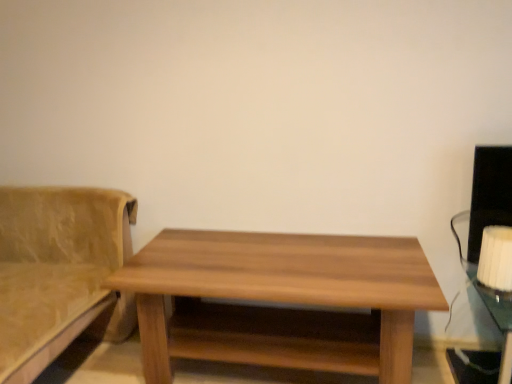
Locate an element on the screen. This screenshot has height=384, width=512. wooden table at center is located at coordinates (280, 300).

Describe the element at coordinates (496, 258) in the screenshot. This screenshot has width=512, height=384. I see `white fabric lampshade at right` at that location.

Describe the element at coordinates (59, 272) in the screenshot. I see `suede-like beige couch at left` at that location.

You are a GUI agent. You are given a task and a screenshot of the screen. Output one action in this format:
    pyautogui.click(x=<x>, y=<y>)
    Task: Click on the wooden table at center
    Image resolution: width=512 pixels, height=384 pixels.
    Given the screenshot: What is the action you would take?
    pyautogui.click(x=280, y=300)

Consider the image. Can we say suede-like beige couch at left lies outside white fabric lampshade at right?

That's correct, suede-like beige couch at left is outside of white fabric lampshade at right.

In the scene shown: Is suede-like beige couch at left in contact with white fabric lampshade at right?

suede-like beige couch at left and white fabric lampshade at right are not in contact.

From a real-world perspective, is suede-like beige couch at left positioned above or below white fabric lampshade at right?

Clearly, from a real-world perspective, suede-like beige couch at left is below white fabric lampshade at right.

Considering the positions of objects suede-like beige couch at left and white fabric lampshade at right in the image provided, who is more to the right, suede-like beige couch at left or white fabric lampshade at right?

Positioned to the right is white fabric lampshade at right.

From a real-world perspective, is white fabric lampshade at right over wooden table at center?

Yes, from a real-world perspective, white fabric lampshade at right is above wooden table at center.

In the image, is white fabric lampshade at right positioned in front of or behind wooden table at center?

white fabric lampshade at right is behind wooden table at center.

This screenshot has width=512, height=384. Identify the location of table lamp positioned vertically above the wooden table at center (from a real-world perspective). (496, 258).

Considering the positions of objects wooden table at center and suede-like beige couch at left in the image provided, who is more to the left, wooden table at center or suede-like beige couch at left?

suede-like beige couch at left.

Considering the positions of objects wooden table at center and suede-like beige couch at left in the image provided, who is in front, wooden table at center or suede-like beige couch at left?

Positioned in front is suede-like beige couch at left.

Is wooden table at center aimed at suede-like beige couch at left?

No.

Is wooden table at center inside the boundaries of white fabric lampshade at right, or outside?

wooden table at center exists outside the volume of white fabric lampshade at right.

Is wooden table at center turned away from white fabric lampshade at right?

No, wooden table at center's orientation is not away from white fabric lampshade at right.

The image size is (512, 384). Identify the location of table in front of the white fabric lampshade at right. (280, 300).

Can you confirm if wooden table at center is bigger than white fabric lampshade at right?

Yes.

Would you consider suede-like beige couch at left to be distant from wooden table at center?

suede-like beige couch at left is near wooden table at center, not far away.

Can you confirm if suede-like beige couch at left is wider than wooden table at center?

Yes.

Is suede-like beige couch at left oriented towards wooden table at center?

No, suede-like beige couch at left is not oriented towards wooden table at center.

Between white fabric lampshade at right and suede-like beige couch at left, which one appears on the left side from the viewer's perspective?

suede-like beige couch at left is more to the left.

Is white fabric lampshade at right positioned before suede-like beige couch at left?

That is False.

Which point is more forward, (487, 265) or (79, 280)?

Positioned in front is point (487, 265).

Are white fabric lampshade at right and suede-like beige couch at left far apart?

white fabric lampshade at right is far away from suede-like beige couch at left.

The width and height of the screenshot is (512, 384). Identify the location of table lamp above the suede-like beige couch at left (from the image's perspective). (496, 258).

Where is `table lamp above the wooden table at center (from a real-world perspective)`? table lamp above the wooden table at center (from a real-world perspective) is located at coordinates (496, 258).

Based on their spatial positions, is suede-like beige couch at left or wooden table at center closer to white fabric lampshade at right?

Among the two, wooden table at center is located nearer to white fabric lampshade at right.

Estimate the real-world distances between objects in this image. Which object is further from wooden table at center, white fabric lampshade at right or suede-like beige couch at left?

white fabric lampshade at right is further to wooden table at center.

Considering their positions, is suede-like beige couch at left positioned closer to wooden table at center than white fabric lampshade at right?

The object closer to wooden table at center is suede-like beige couch at left.

From the image, which object appears to be farther from white fabric lampshade at right, wooden table at center or suede-like beige couch at left?

The object further to white fabric lampshade at right is suede-like beige couch at left.

Which object lies further to the anchor point suede-like beige couch at left, white fabric lampshade at right or wooden table at center?

white fabric lampshade at right lies further to suede-like beige couch at left than the other object.

When comparing their distances from suede-like beige couch at left, does wooden table at center or white fabric lampshade at right seem closer?

Among the two, wooden table at center is located nearer to suede-like beige couch at left.

This screenshot has width=512, height=384. In order to click on table between suede-like beige couch at left and white fabric lampshade at right in the horizontal direction in this screenshot , I will do `click(280, 300)`.